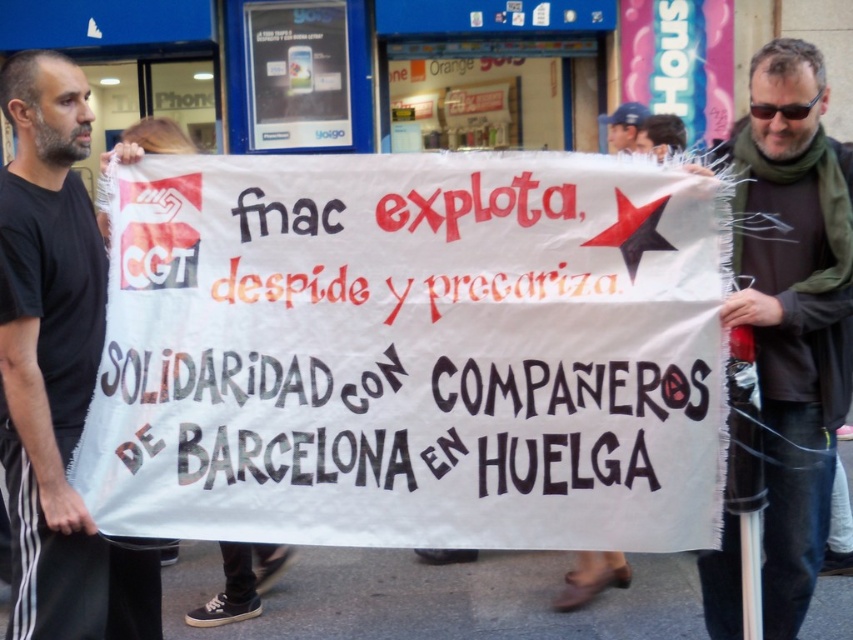
You are a photographer standing 2 meters away from the point at (x=653, y=474). You want to take a photo of the protest banner so that both the banner and the storefront are clearly visible. Can you step back to a position where you can capture both elements in the frame without moving the camera? Explain your reasoning.

The photographer is currently 2 meters away from the point at (x=653, y=474). The objects are 3.60 meters apart. By stepping back, the photographer can increase the distance between themselves and the point, allowing both the banner and storefront to fit into the frame since the required distance to capture both is greater than the 3.60 meters separation between them.